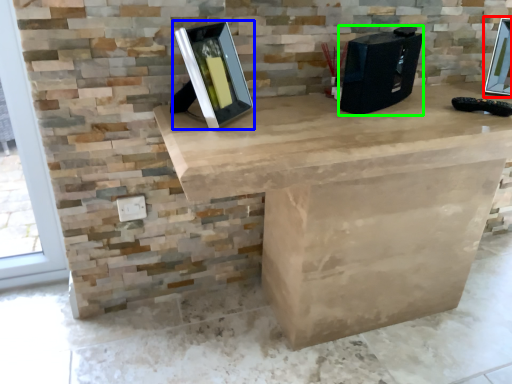
Question: Based on their relative distances, which object is nearer to picture frame (highlighted by a red box)? Choose from picture frame (highlighted by a blue box) and desktop computer (highlighted by a green box).

Choices:
 (A) picture frame
 (B) desktop computer

Answer: (B)